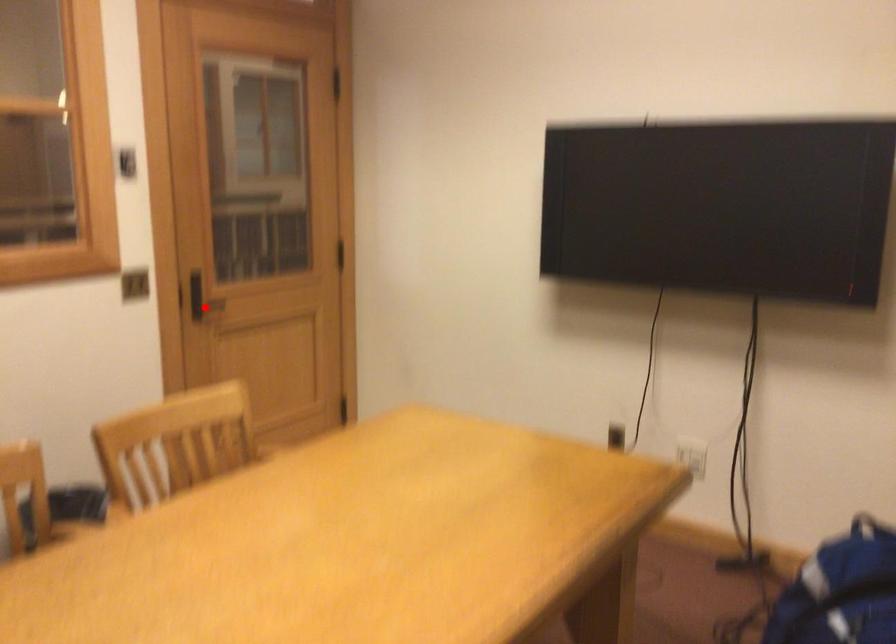
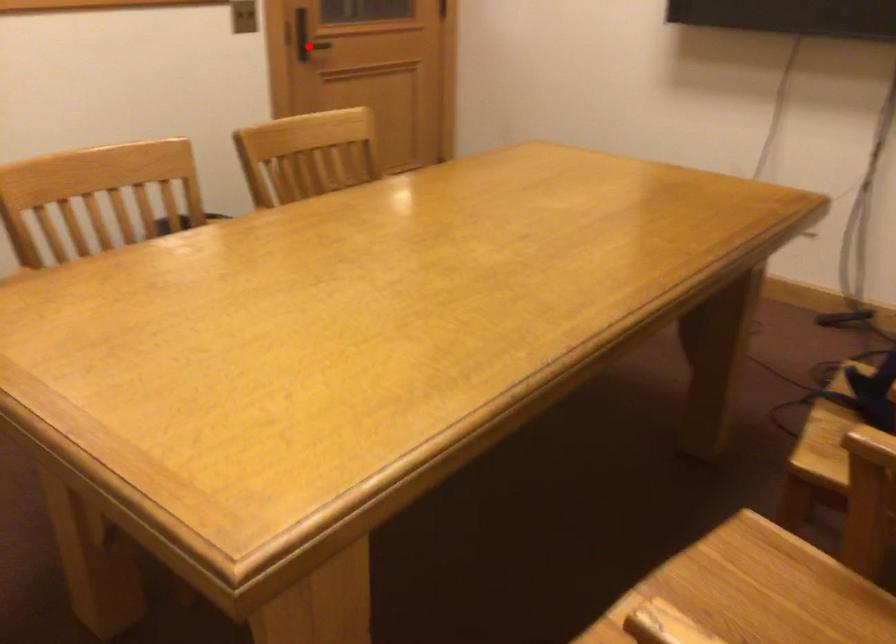
Based on the photo, I am providing you with two images of the same scene from different viewpoints. A red point is marked on the first image and another point is marked on the second image. Is the red point in image1 aligned with the point shown in image2?

Yes